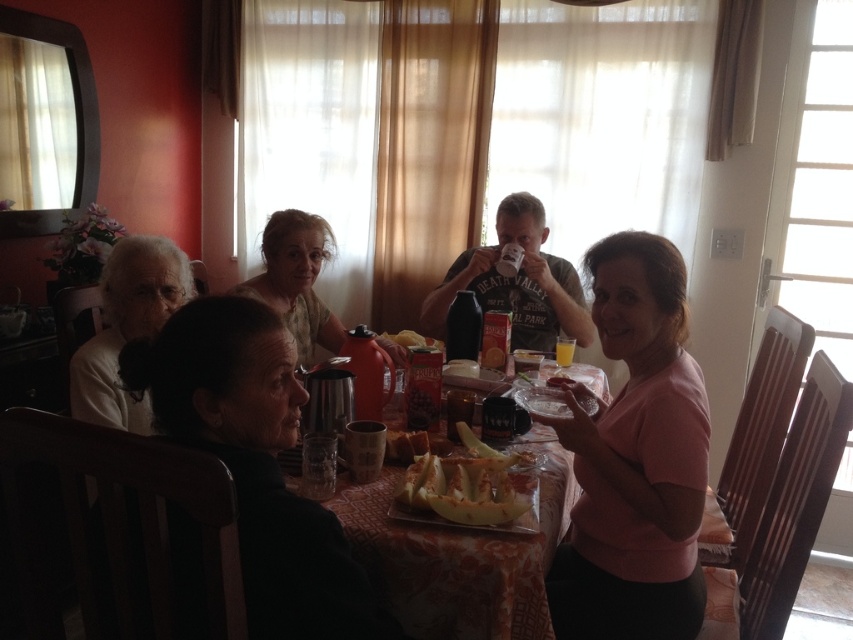
Question: Which of the following is the farthest from the observer?

Choices:
 (A) (279, 280)
 (B) (633, 362)
 (C) (474, 460)
 (D) (560, 460)

Answer: (A)

Question: Is pink matte shirt at center in front of dark brown hair at lower left?

Choices:
 (A) no
 (B) yes

Answer: (A)

Question: Which is farther from the pink matte shirt at center?

Choices:
 (A) pink matte shirt at upper right
 (B) dark gray t-shirt at center
 (C) white matte hair at left

Answer: (C)

Question: Which point appears farthest from the camera in this image?

Choices:
 (A) (518, 211)
 (B) (129, 262)

Answer: (A)

Question: Is the position of dark gray t-shirt at center more distant than that of white matte hair at left?

Choices:
 (A) yes
 (B) no

Answer: (A)

Question: Does dark gray t-shirt at center have a larger size compared to matte yellow shirt at center?

Choices:
 (A) yes
 (B) no

Answer: (A)